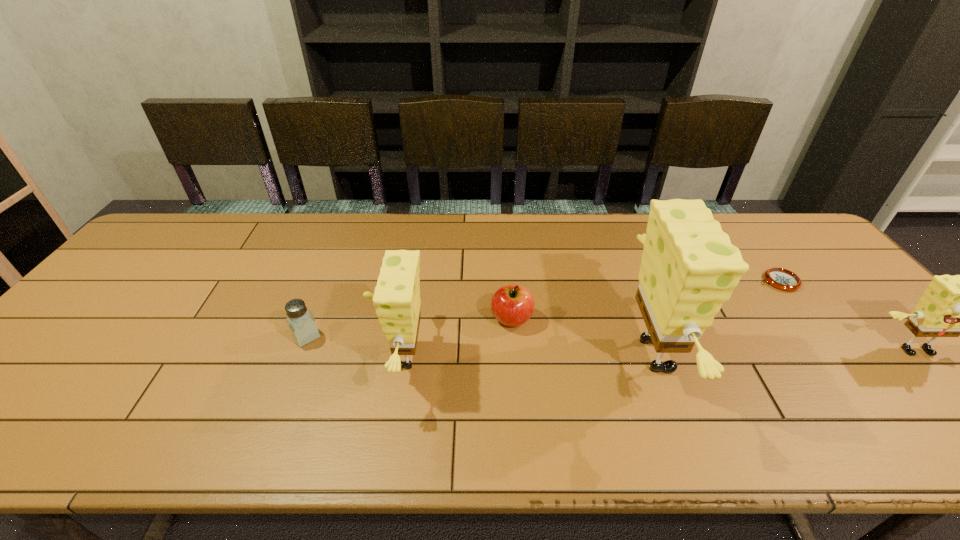
Find the location of a particular element. This screenshot has width=960, height=540. vacant space at the far right corner of the desktop is located at coordinates (788, 240).

The width and height of the screenshot is (960, 540). I want to click on free space that is in between the saltshaker and the leftmost sponge, so click(x=354, y=347).

In order to click on vacant area between the compass and the tallest object in this screenshot , I will do `click(720, 318)`.

Find the location of a particular element. The height and width of the screenshot is (540, 960). vacant space that is in between the leftmost sponge and the leftmost object is located at coordinates (354, 347).

I want to click on vacant point located between the fourth object from left to right and the apple, so click(x=587, y=337).

Locate which object is the fifth closest to the leftmost object. Please provide its 2D coordinates. Your answer should be formatted as a tuple, i.e. [(x, y)], where the tuple contains the x and y coordinates of a point satisfying the conditions above.

[(952, 306)]

Locate an element on the screen. This screenshot has width=960, height=540. object that is the third closest to the saltshaker is located at coordinates (689, 268).

At what (x,y) coordinates should I click in order to perform the action: click on sponge that is the closest one to the fifth shortest object. Please return your answer as a coordinate pair (x, y). The height and width of the screenshot is (540, 960). Looking at the image, I should click on (689, 268).

Find the location of a particular element. the closest sponge to the apple is located at coordinates click(397, 301).